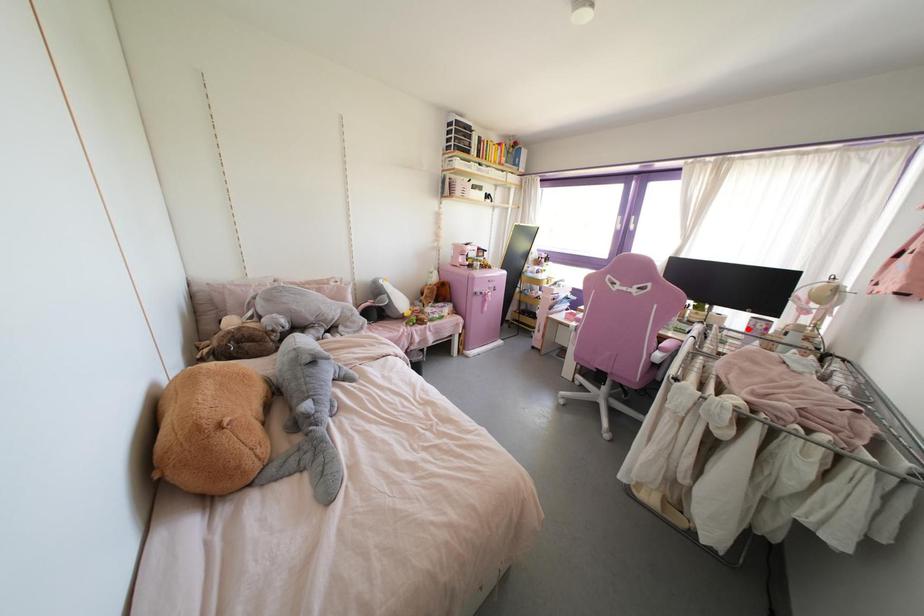
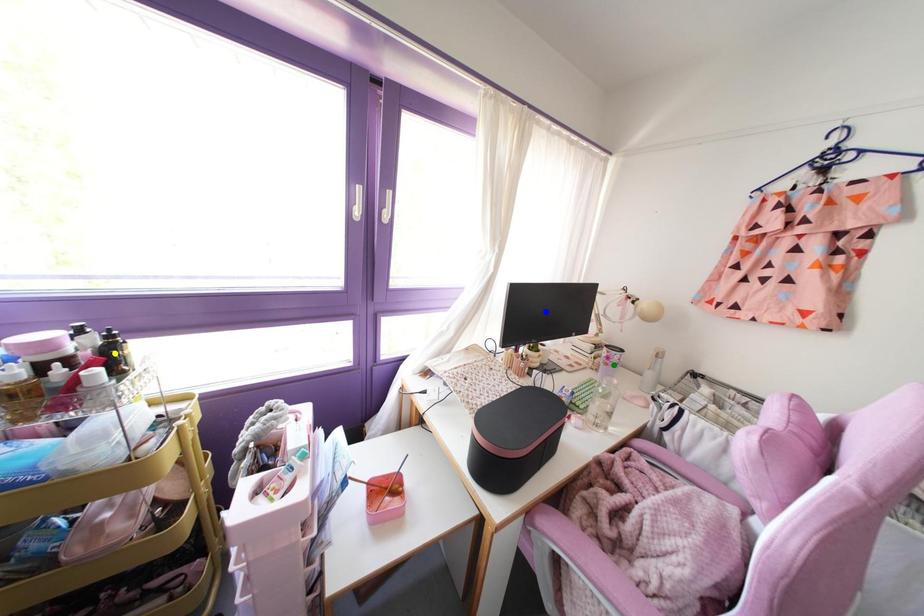
Question: I am providing you with two images of the same scene from different viewpoints. A red point is marked on the first image. You are given multiple points on the second image. Which mark in image 2 goes with the point in image 1?

Choices:
 (A) blue point
 (B) yellow point
 (C) green point

Answer: (C)